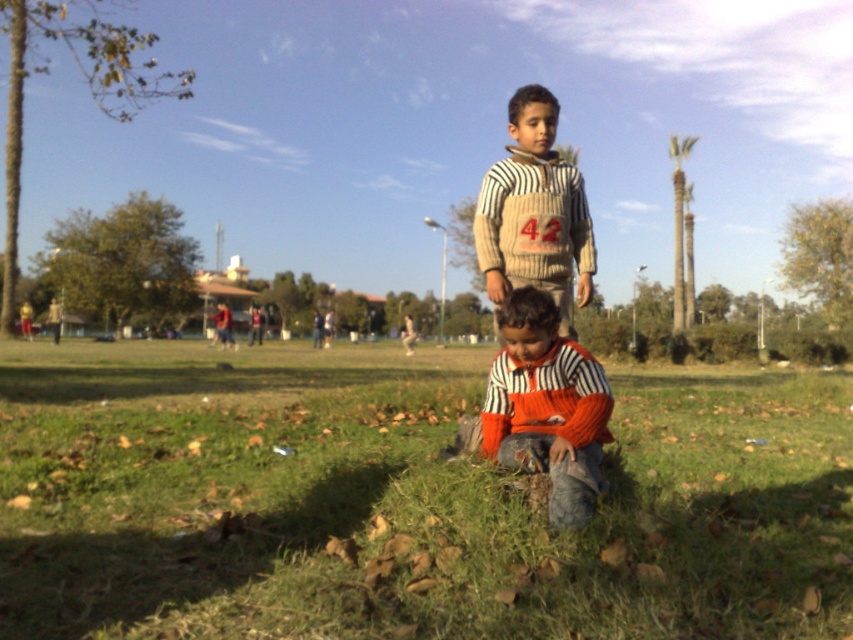
You are a photographer trying to capture both children in the scene. The striped wool sweater at center and the striped sweater at center are two children sitting in the foreground. Which child should you focus on first to ensure both are in frame?

The striped wool sweater at center has a lesser height compared to striped sweater at center, so you should focus on the taller striped sweater at center first to ensure both are in frame.

You are standing in the park and want to place a picnic blanket. The green grass at center is located at coordinates point 0.784, 0.475. Is this a suitable spot for the blanket?

Yes, the green grass at center is located at point [404,500], making it a suitable spot for placing the picnic blanket.